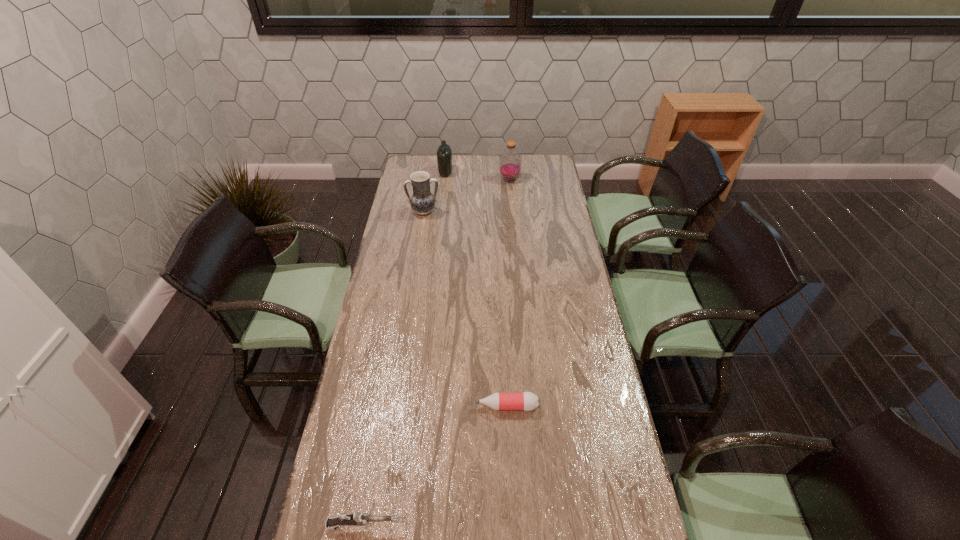
At what (x,y) coordinates should I click in order to perform the action: click on pottery. Please return your answer as a coordinate pair (x, y). Looking at the image, I should click on (422, 201).

You are a GUI agent. You are given a task and a screenshot of the screen. Output one action in this format:
    pyautogui.click(x=<x>, y=<y>)
    Task: Click on the leftmost bottle
    This screenshot has height=540, width=960.
    Given the screenshot: What is the action you would take?
    pyautogui.click(x=444, y=153)

Locate an element on the screen. the nearest object is located at coordinates (356, 518).

Where is `gun`? gun is located at coordinates (356, 518).

This screenshot has width=960, height=540. Identify the location of the nearest bottle. tap(528, 401).

This screenshot has height=540, width=960. Identify the location of the fourth farthest object. (528, 401).

The height and width of the screenshot is (540, 960). I want to click on free location located 0.100m on the right of the pottery, so click(x=461, y=212).

You are a GUI agent. You are given a task and a screenshot of the screen. Output one action in this format:
    pyautogui.click(x=<x>, y=<y>)
    Task: Click on the vacant space located on the left of the leftmost bottle
    
    Given the screenshot: What is the action you would take?
    pyautogui.click(x=423, y=173)

The image size is (960, 540). What are the coordinates of `free space located aimed along the barrel of the second shortest object` in the screenshot? It's located at (454, 526).

Where is `free space located with the cap open on the fourth farthest object`? The width and height of the screenshot is (960, 540). free space located with the cap open on the fourth farthest object is located at coordinates (456, 406).